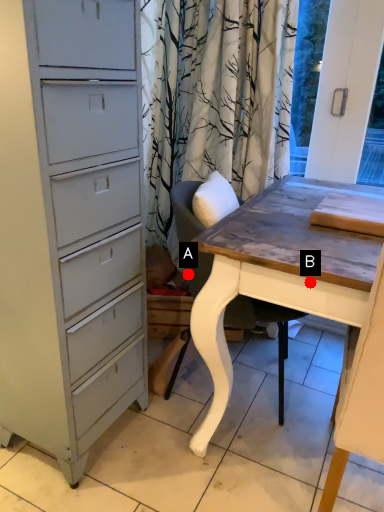
Question: Two points are circled on the image, labeled by A and B beside each circle. Which point is further to the camera?

Choices:
 (A) A is further
 (B) B is further

Answer: (A)